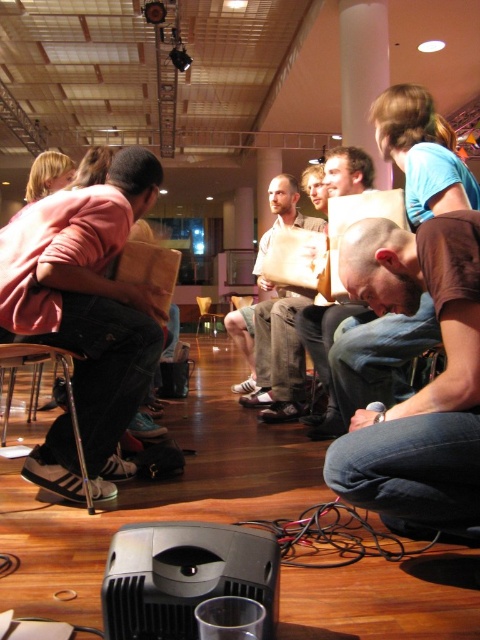
Can you confirm if light brown fabric shirt at center is taller than wooden chair at center?

Correct, light brown fabric shirt at center is much taller as wooden chair at center.

Is light brown fabric shirt at center thinner than wooden chair at center?

Indeed, light brown fabric shirt at center has a lesser width compared to wooden chair at center.

The width and height of the screenshot is (480, 640). I want to click on light brown fabric shirt at center, so click(x=269, y=348).

Locate an element on the screen. This screenshot has width=480, height=640. light brown fabric shirt at center is located at coordinates (269, 348).

Between point (454, 388) and point (285, 328), which one is positioned in front?

Point (454, 388) is more forward.

Can you confirm if brown cotton shirt at lower right is positioned to the right of light brown fabric shirt at center?

Correct, you'll find brown cotton shirt at lower right to the right of light brown fabric shirt at center.

Between point (402, 426) and point (252, 368), which one is positioned behind?

The point (252, 368) is behind.

Identify the location of brown cotton shirt at lower right. The height and width of the screenshot is (640, 480). (423, 387).

Can you confirm if brown cotton shirt at lower right is positioned below wooden chair at center?

Yes.

Can you confirm if brown cotton shirt at lower right is positioned to the right of wooden chair at center?

Yes, brown cotton shirt at lower right is to the right of wooden chair at center.

The image size is (480, 640). I want to click on brown cotton shirt at lower right, so click(423, 387).

You are a GUI agent. You are given a task and a screenshot of the screen. Output one action in this format:
    pyautogui.click(x=<x>, y=<y>)
    Task: Click on the brown cotton shirt at lower right
    
    Given the screenshot: What is the action you would take?
    pyautogui.click(x=423, y=387)